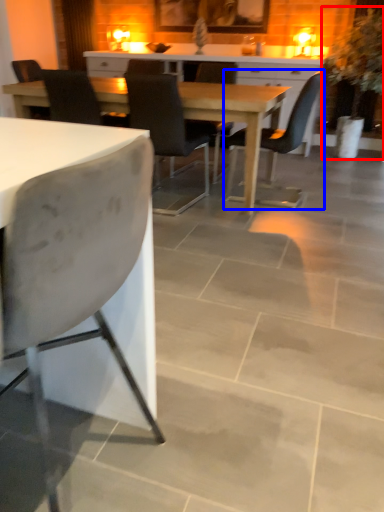
Question: Which object is further to the camera taking this photo, houseplant (highlighted by a red box) or chair (highlighted by a blue box)?

Choices:
 (A) houseplant
 (B) chair

Answer: (A)